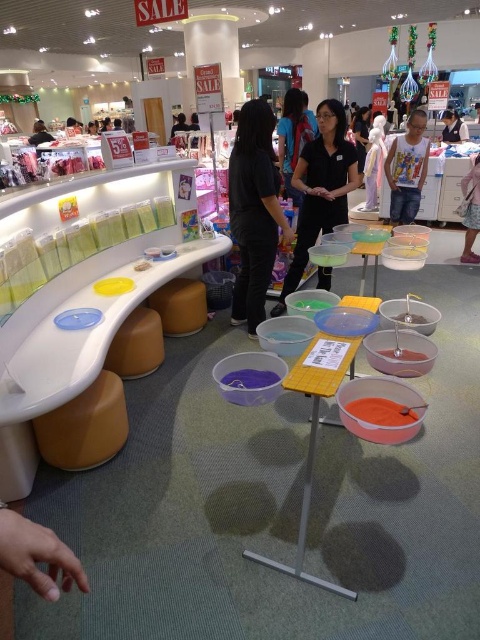
Question: Which of the following is the farthest from the observer?

Choices:
 (A) (105, 416)
 (B) (235, 296)
 (C) (447, 131)

Answer: (C)

Question: Can you confirm if matte orange stool at lower left is positioned to the left of matte brown stool at lower left?

Choices:
 (A) yes
 (B) no

Answer: (A)

Question: Does black fabric shirt at center have a lesser width compared to matte black shirt at upper right?

Choices:
 (A) no
 (B) yes

Answer: (B)

Question: Which point appears farthest from the camera in this image?

Choices:
 (A) (325, 192)
 (B) (251, 301)
 (C) (175, 308)

Answer: (C)

Question: Can you confirm if black matte shirt at center is wider than matte orange stool at lower left?

Choices:
 (A) yes
 (B) no

Answer: (A)

Question: Which point is closer to the camera taking this photo?

Choices:
 (A) (67, 467)
 (B) (184, 305)

Answer: (A)